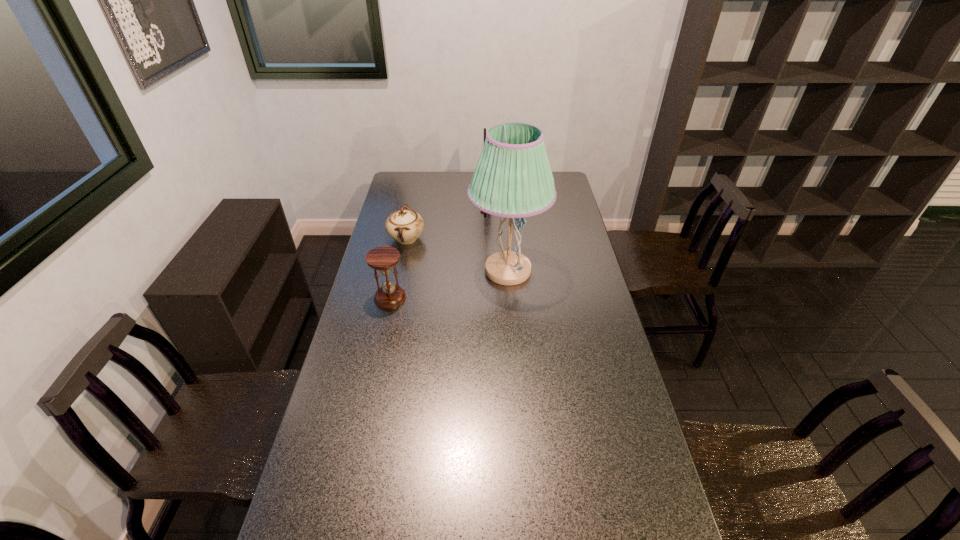
You are a GUI agent. You are given a task and a screenshot of the screen. Output one action in this format:
    pyautogui.click(x=<x>, y=<y>)
    Task: Click on the lamp
    
    Given the screenshot: What is the action you would take?
    pyautogui.click(x=513, y=179)

Image resolution: width=960 pixels, height=540 pixels. I want to click on computer monitor, so click(x=485, y=214).

The height and width of the screenshot is (540, 960). I want to click on hourglass, so click(x=383, y=258).

Identify the location of chinaware. The height and width of the screenshot is (540, 960). (405, 225).

Locate an element on the screen. This screenshot has width=960, height=540. vacant space located 0.280m on the back of the tallest object is located at coordinates (503, 212).

Where is `free spot located on the screen side of the third shortest object`? This screenshot has width=960, height=540. free spot located on the screen side of the third shortest object is located at coordinates (443, 204).

Image resolution: width=960 pixels, height=540 pixels. In order to click on free space located on the screen side of the third shortest object in this screenshot , I will do `click(402, 204)`.

Find the location of a particular element. The height and width of the screenshot is (540, 960). free spot located on the screen side of the third shortest object is located at coordinates (406, 204).

Image resolution: width=960 pixels, height=540 pixels. In order to click on free region located 0.060m on the front of the second shortest object in this screenshot , I will do `click(385, 321)`.

I want to click on free space located on the front of the shortest object, so click(x=398, y=279).